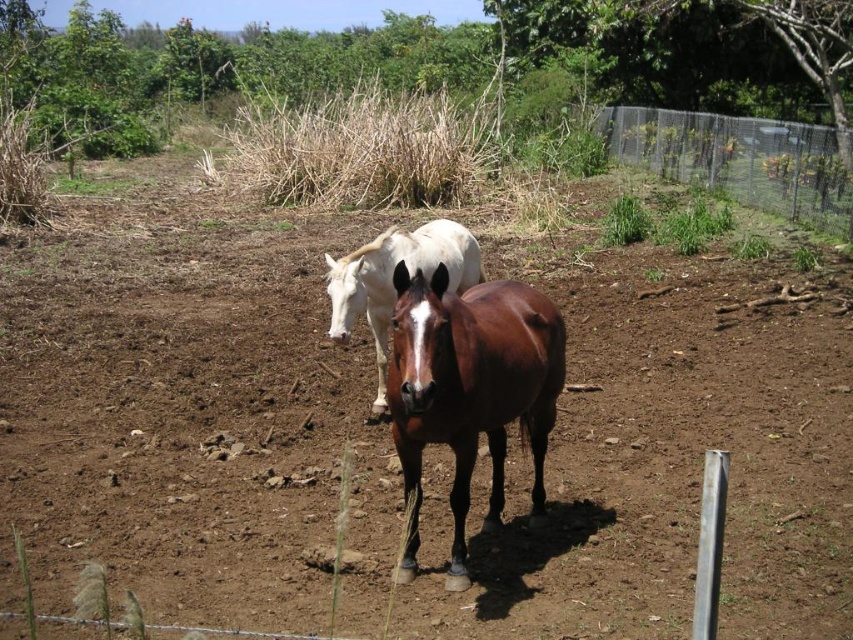
Question: Does brown glossy horse at center come in front of metallic wire mesh at upper right?

Choices:
 (A) yes
 (B) no

Answer: (A)

Question: Which of the following is the farthest from the observer?

Choices:
 (A) (469, 243)
 (B) (552, 368)
 (C) (630, 131)

Answer: (C)

Question: Is metallic wire mesh at upper right closer to camera compared to white glossy horse at center?

Choices:
 (A) yes
 (B) no

Answer: (B)

Question: Which object is farther from the camera taking this photo?

Choices:
 (A) metallic wire mesh at upper right
 (B) brown glossy horse at center

Answer: (A)

Question: Is metallic wire mesh at upper right wider than white glossy horse at center?

Choices:
 (A) no
 (B) yes

Answer: (B)

Question: Among these points, which one is nearest to the camera?

Choices:
 (A) (412, 266)
 (B) (817, 224)
 (C) (421, 344)

Answer: (C)